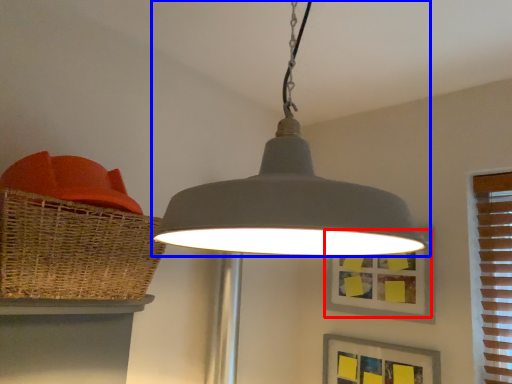
Question: Which of the following is the farthest to the observer, picture frame (highlighted by a red box) or lamp (highlighted by a blue box)?

Choices:
 (A) picture frame
 (B) lamp

Answer: (A)